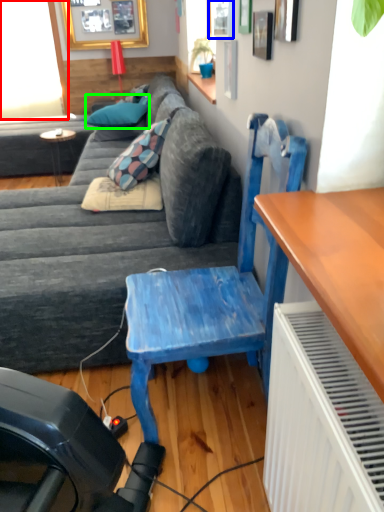
Question: Which object is the farthest from window screen (highlighted by a red box)? Choose among these: window (highlighted by a blue box) or pillow (highlighted by a green box).

Choices:
 (A) window
 (B) pillow

Answer: (A)